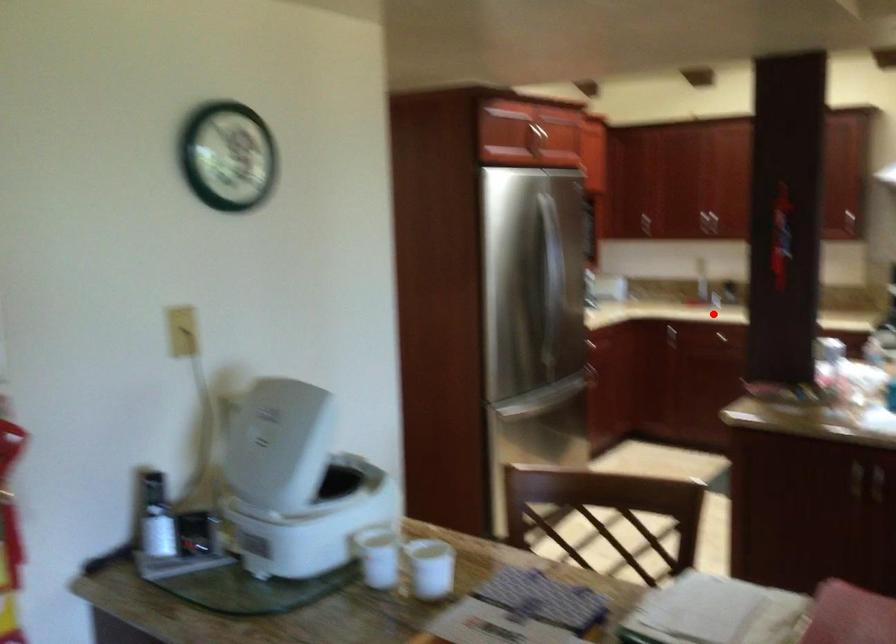
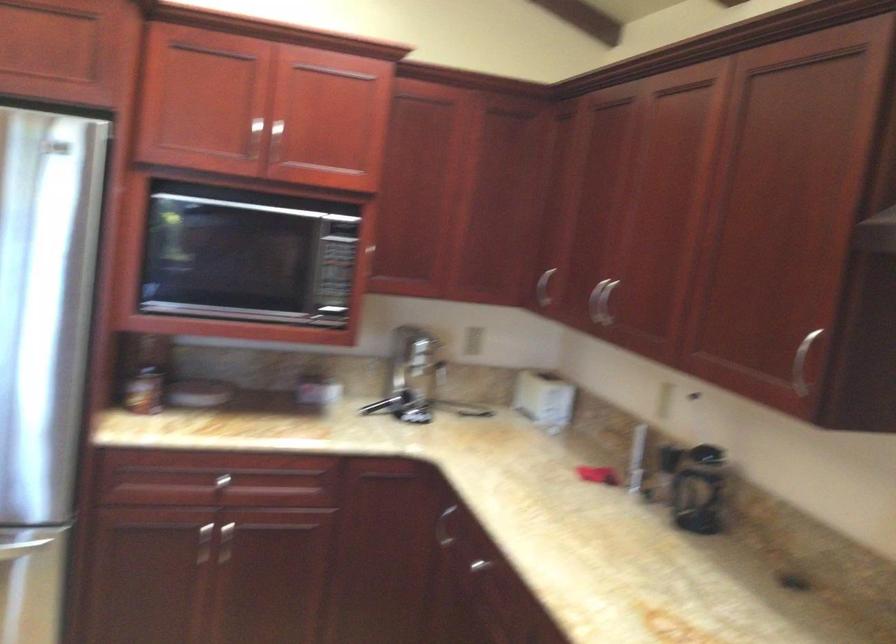
Find the pixel in the second image that matches the highlighted location in the first image.

(495, 567)